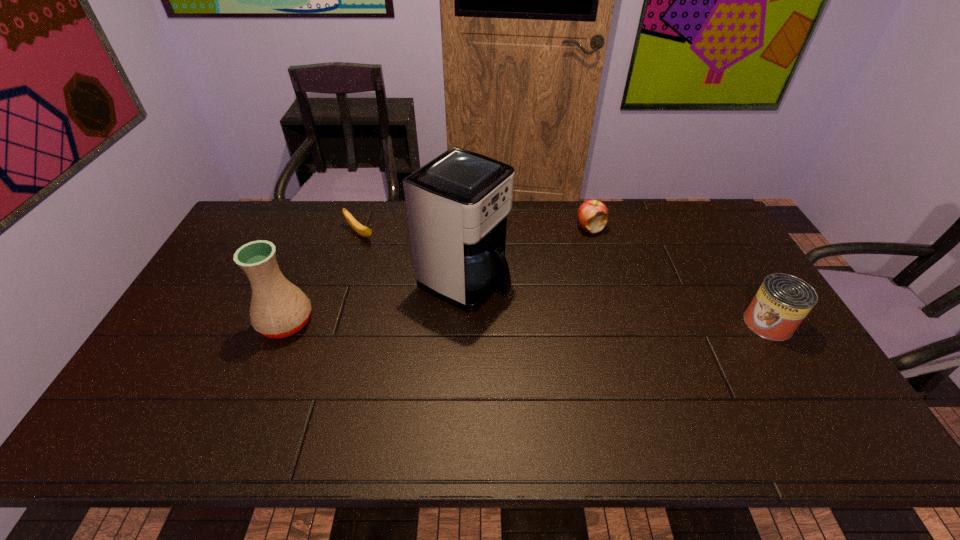
The width and height of the screenshot is (960, 540). In order to click on vacant area that lies between the banana and the second tallest object in this screenshot , I will do `click(324, 278)`.

Where is `free spot between the can and the second shortest object`? This screenshot has height=540, width=960. free spot between the can and the second shortest object is located at coordinates (679, 276).

Where is `vacant space that is in between the third shortest object and the fourth shortest object`? Image resolution: width=960 pixels, height=540 pixels. vacant space that is in between the third shortest object and the fourth shortest object is located at coordinates (527, 323).

Identify which object is the second nearest to the tallest object. Please provide its 2D coordinates. Your answer should be formatted as a tuple, i.e. [(x, y)], where the tuple contains the x and y coordinates of a point satisfying the conditions above.

[(592, 215)]

This screenshot has height=540, width=960. Identify the location of the third closest object to the third tallest object. (363, 231).

I want to click on vacant area that satisfies the following two spatial constraints: 1. on the front side of the pottery; 2. on the right side of the third shortest object, so click(286, 323).

Locate an element on the screen. vacant space that satisfies the following two spatial constraints: 1. on the back side of the banana; 2. on the left side of the second object from right to left is located at coordinates (363, 228).

This screenshot has width=960, height=540. I want to click on free space in the image that satisfies the following two spatial constraints: 1. on the back side of the apple; 2. on the right side of the coffee maker, so click(x=466, y=228).

This screenshot has height=540, width=960. I want to click on vacant area in the image that satisfies the following two spatial constraints: 1. on the front side of the rightmost object; 2. on the left side of the shortest object, so click(333, 323).